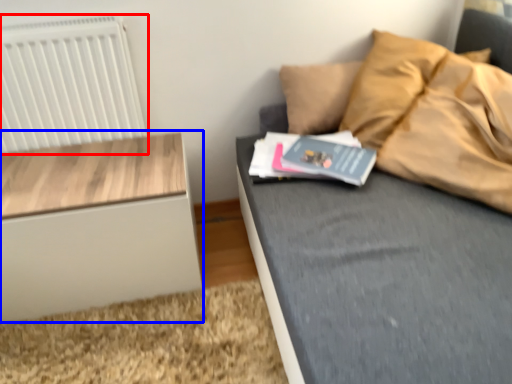
Question: Which object appears farthest to the camera in this image, radiator (highlighted by a red box) or nightstand (highlighted by a blue box)?

Choices:
 (A) radiator
 (B) nightstand

Answer: (A)